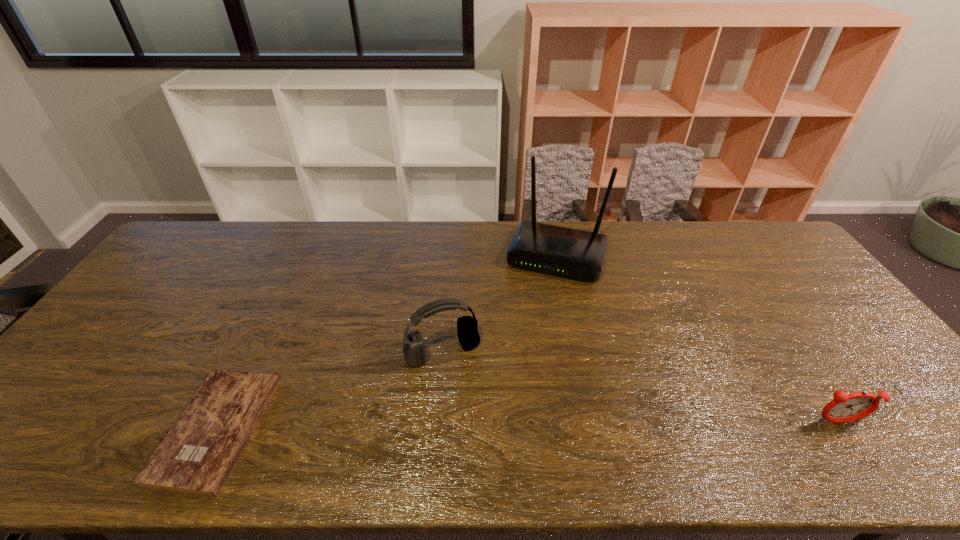
At what (x,y) coordinates should I click in order to perform the action: click on vacant space on the desktop that is between the Bible and the second shortest object and is positioned on the headband of the second object from left to right. Please return your answer as a coordinate pair (x, y). Looking at the image, I should click on (475, 426).

Identify the location of free space on the desktop that is between the Bible and the alarm clock and is positioned on the front-facing side of the router. (503, 426).